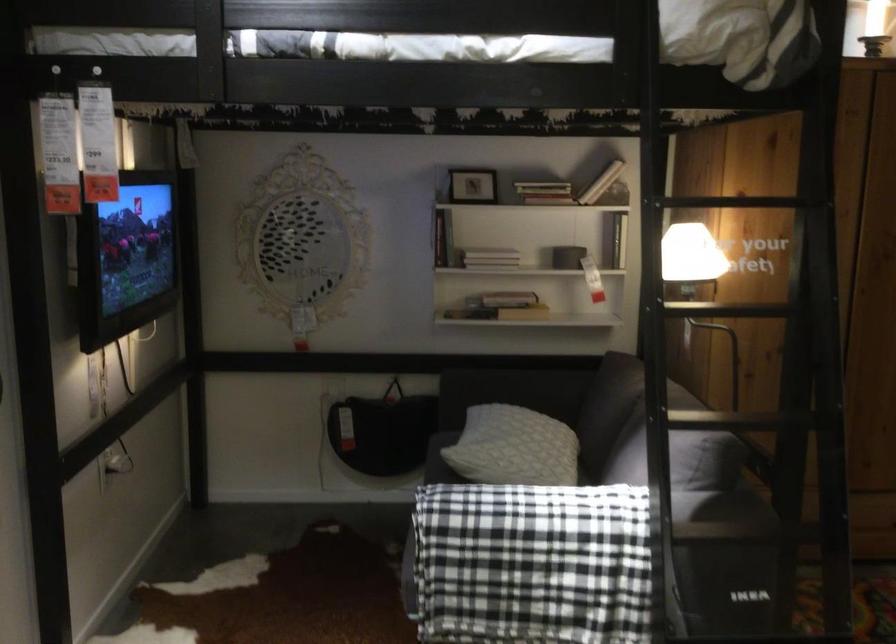
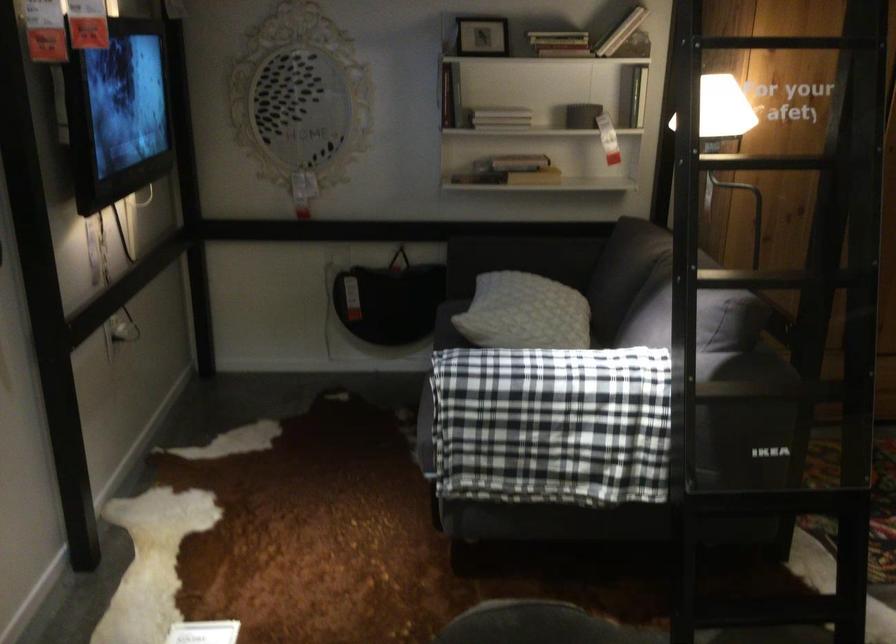
The point at (503, 310) is marked in the first image. Where is the corresponding point in the second image?

(509, 171)